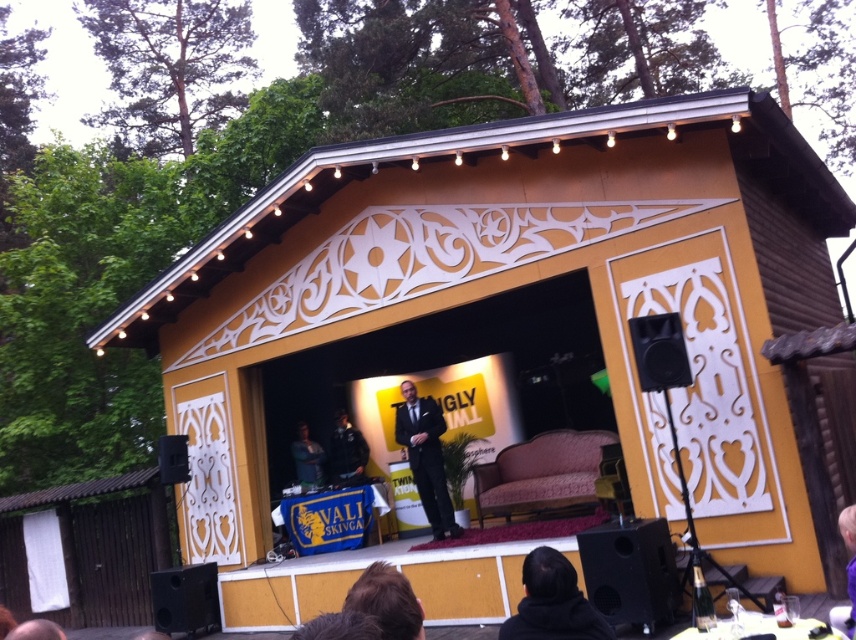
Question: Which of the following is the farthest from the observer?

Choices:
 (A) dark blue shirt at center
 (B) black fabric at lower right
 (C) matte black suit at center

Answer: (A)

Question: Among these points, which one is farthest from the camera?

Choices:
 (A) (434, 506)
 (B) (545, 584)
 (C) (306, 442)

Answer: (C)

Question: Is black fabric at lower right below dark blue shirt at center?

Choices:
 (A) yes
 (B) no

Answer: (B)

Question: Is matte black suit at center smaller than dark blue shirt at center?

Choices:
 (A) no
 (B) yes

Answer: (A)

Question: Can you confirm if black fabric at lower right is positioned to the left of dark blue shirt at center?

Choices:
 (A) yes
 (B) no

Answer: (B)

Question: Which of the following is the farthest from the observer?

Choices:
 (A) dark blue shirt at center
 (B) matte black suit at center
 (C) black fabric at lower right

Answer: (A)